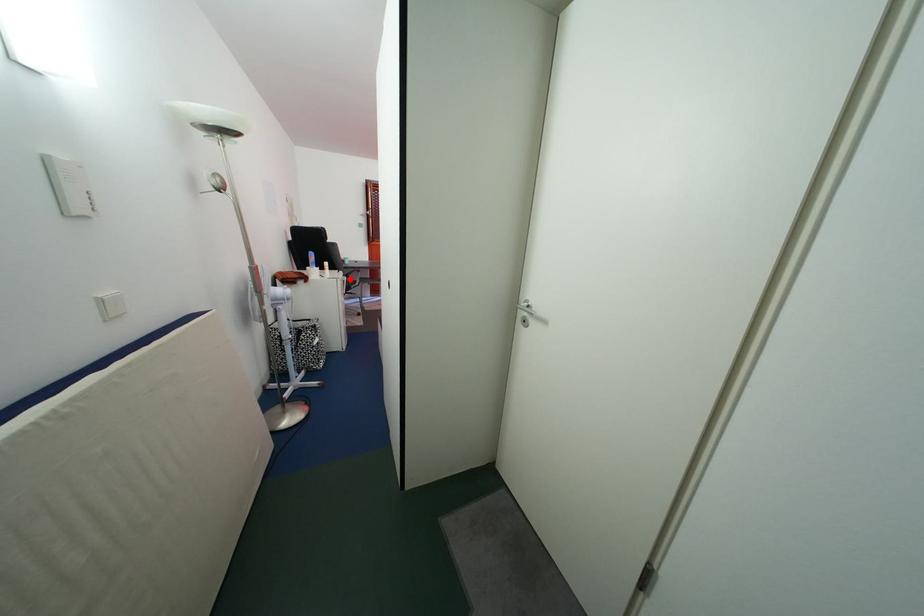
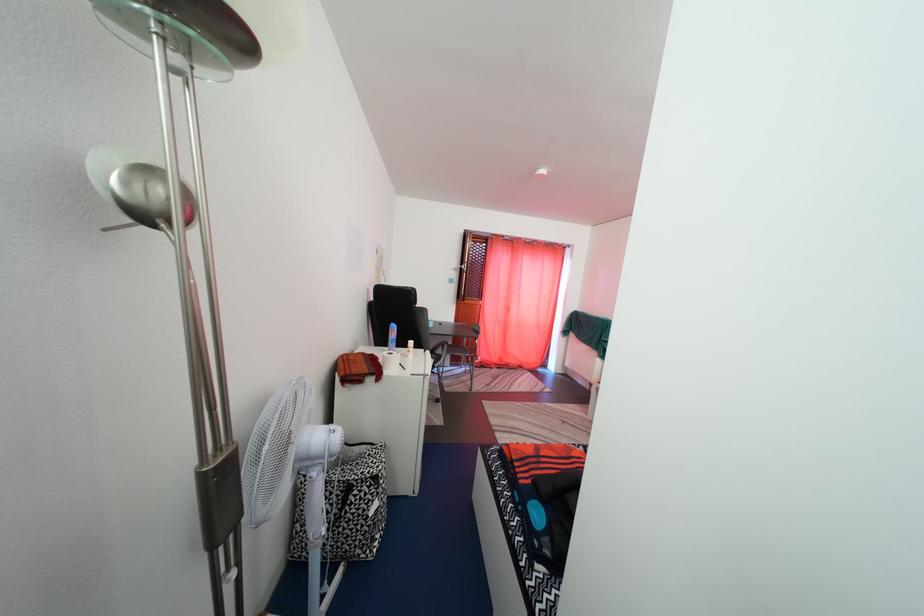
Locate, in the second image, the point that corresponds to the highlighted location in the first image.

(436, 359)